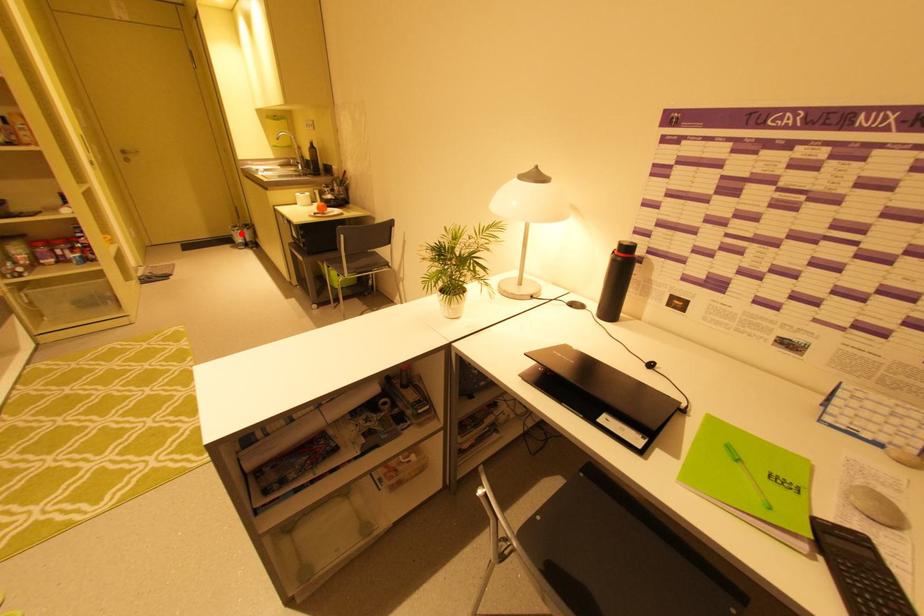
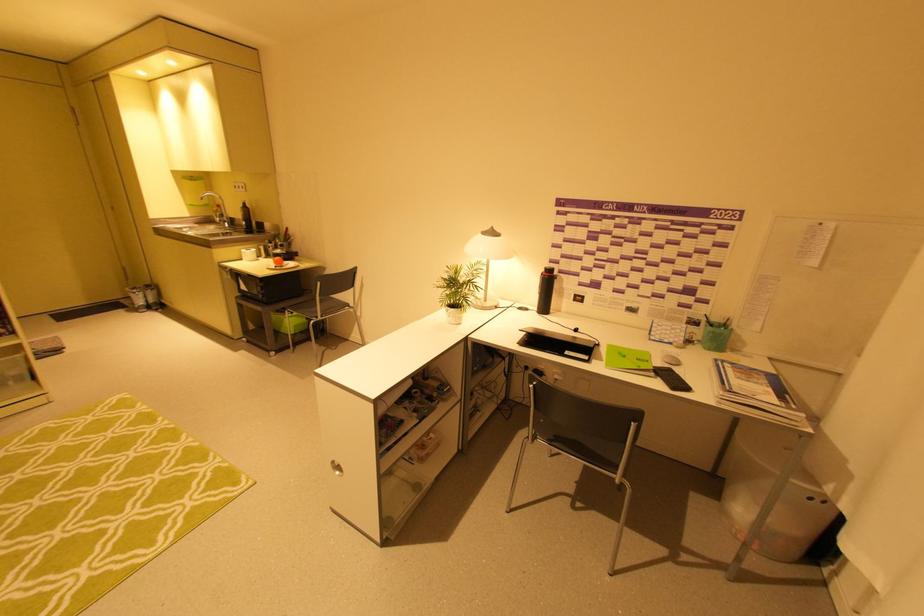
Question: A red point is marked in image1. In image2, is the corresponding 3D point closer to the camera or farther? Reply with the corresponding letter.

Choices:
 (A) The corresponding 3D point is closer.
 (B) The corresponding 3D point is farther.

Answer: (B)